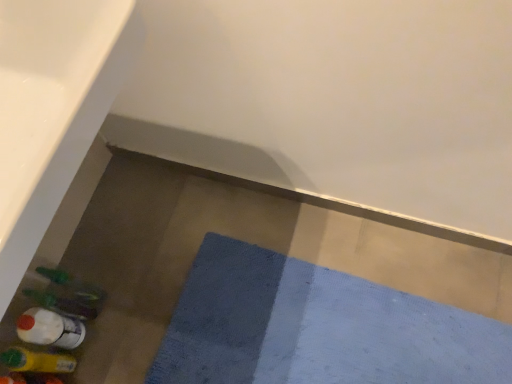
Where is `empty space that is in between translucent plastic bottle at lower left, the 3th bottle positioned from the bottom, and blue textured bath mat at lower center`? The height and width of the screenshot is (384, 512). empty space that is in between translucent plastic bottle at lower left, the 3th bottle positioned from the bottom, and blue textured bath mat at lower center is located at coordinates (146, 299).